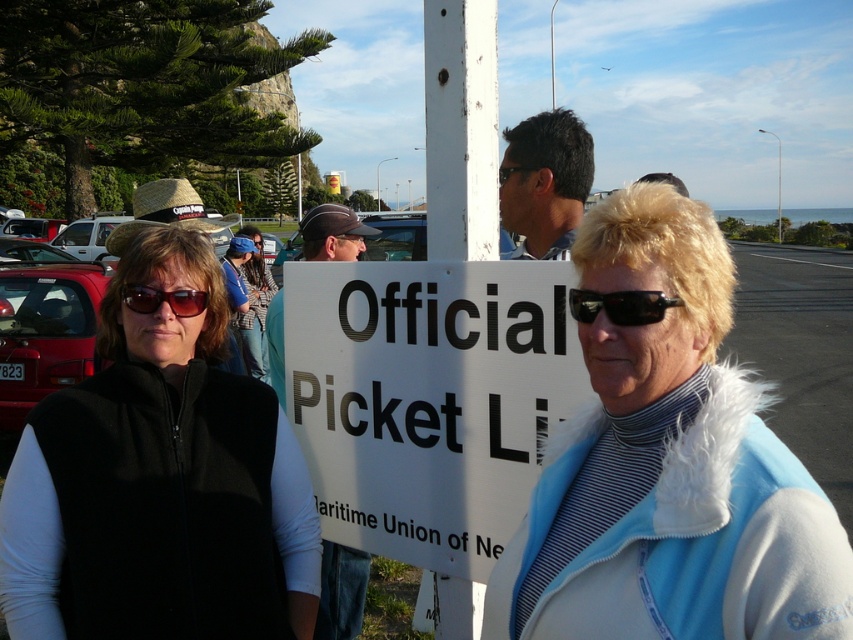
Question: Considering the real-world distances, which object is closest to the white plastic sign at center?

Choices:
 (A) blue fleece vest at center
 (B) denim pants at center
 (C) white paper sign at center

Answer: (C)

Question: Can you confirm if blue fleece vest at center is positioned to the right of matte black cap at center?

Choices:
 (A) yes
 (B) no

Answer: (A)

Question: Which object appears closest to the camera in this image?

Choices:
 (A) matte black cap at center
 (B) black plastic goggles at center

Answer: (A)

Question: Where is matte black cap at center located in relation to white plastic sign at center in the image?

Choices:
 (A) left
 (B) right

Answer: (A)

Question: Which object appears farthest from the camera in this image?

Choices:
 (A) black plastic sunglasses at center
 (B) matte black sunglasses at left
 (C) matte black cap at center

Answer: (C)

Question: Can you confirm if white paper sign at center is positioned to the left of black plastic sunglasses at center?

Choices:
 (A) no
 (B) yes

Answer: (B)